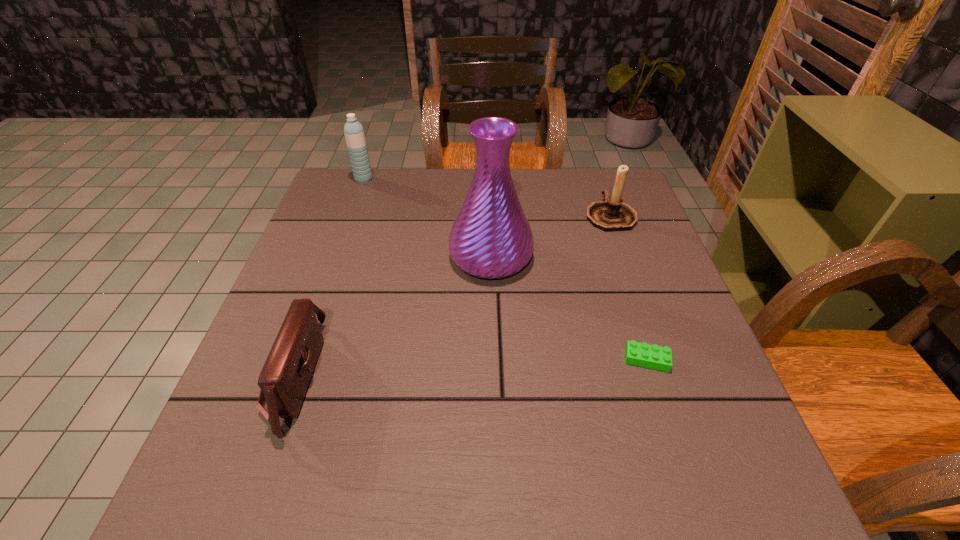
Locate an element on the screen. Image resolution: width=960 pixels, height=540 pixels. free space located 0.190m on the front flap of the second shortest object is located at coordinates (418, 377).

The image size is (960, 540). Identify the location of vacant space located on the right of the Lego. (700, 359).

Locate an element on the screen. The image size is (960, 540). water bottle situated at the far edge is located at coordinates (354, 134).

Locate an element on the screen. candle holder that is at the far edge is located at coordinates (612, 214).

I want to click on water bottle present at the left edge, so click(354, 134).

Find the location of a particular element. The width and height of the screenshot is (960, 540). shoulder bag that is positioned at the left edge is located at coordinates (284, 379).

Find the location of a particular element. This screenshot has height=540, width=960. candle holder that is at the right edge is located at coordinates (612, 214).

Identify the location of Lego that is at the right edge. (653, 356).

You are a GUI agent. You are given a task and a screenshot of the screen. Output one action in this format:
    pyautogui.click(x=<x>, y=<y>)
    Task: Click on the object at the far left corner
    The width and height of the screenshot is (960, 540).
    Given the screenshot: What is the action you would take?
    pyautogui.click(x=354, y=134)

Locate an element on the screen. This screenshot has height=540, width=960. object at the far right corner is located at coordinates (612, 214).